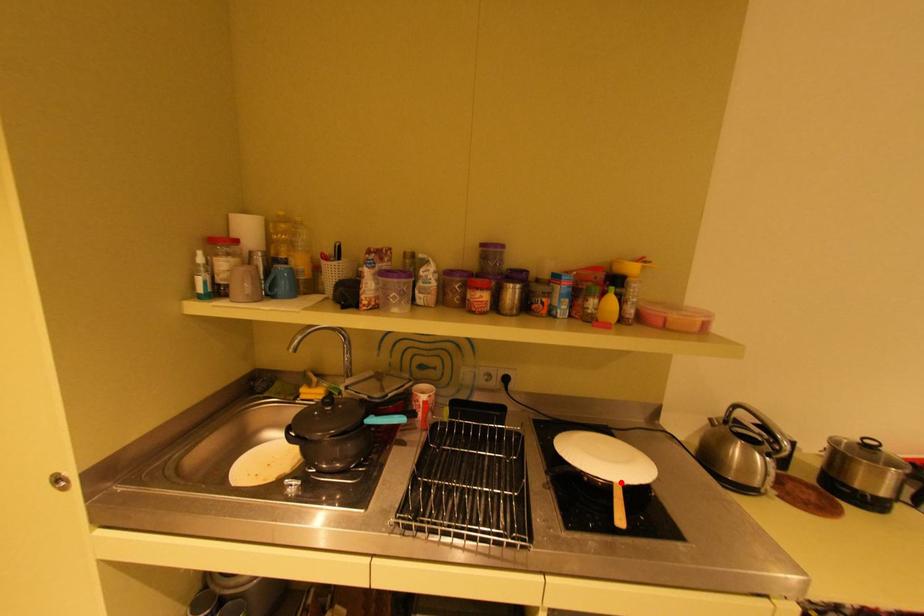
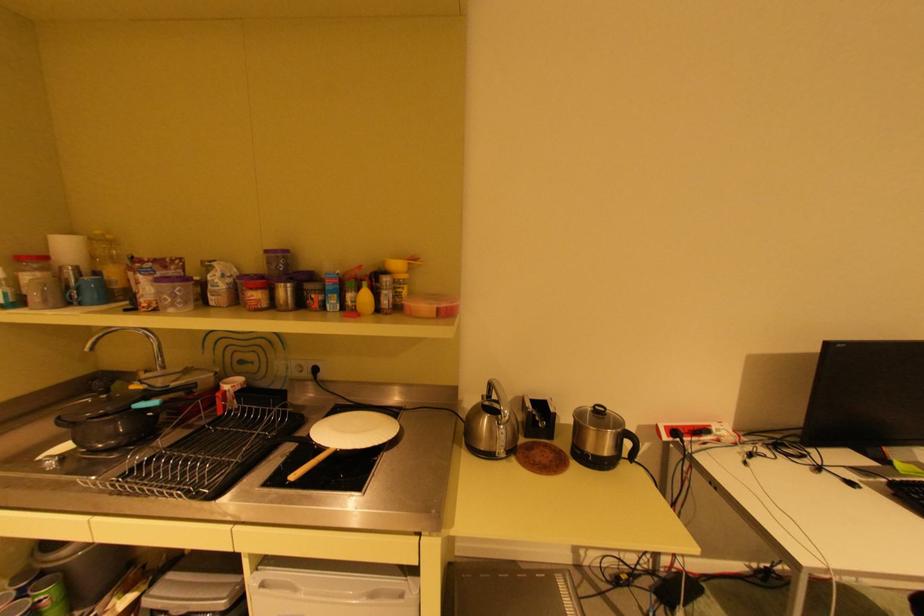
In the second image, find the point that corresponds to the highlighted location in the first image.

(337, 448)